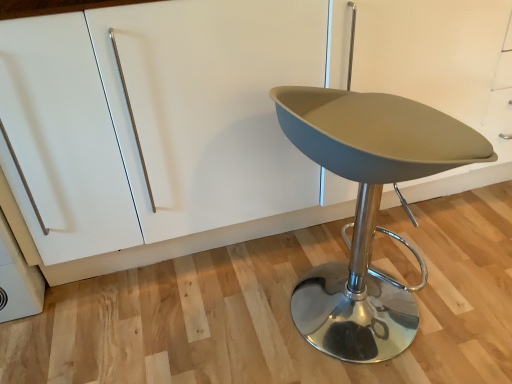
Find the location of a particular element. The image size is (512, 384). free spot to the left of matte gray stool at center is located at coordinates (228, 315).